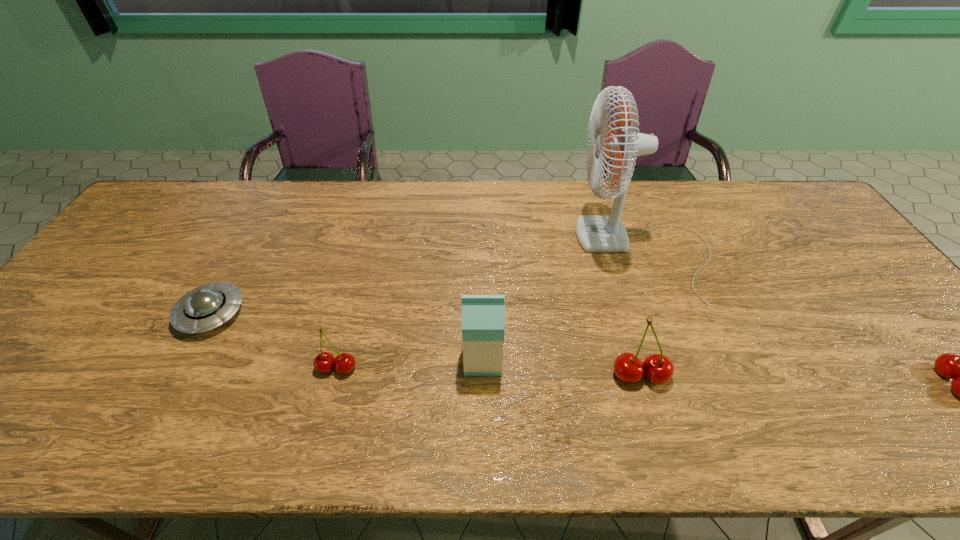
The height and width of the screenshot is (540, 960). I want to click on empty space that is in between the shortest object and the fourth object from right to left, so click(x=347, y=337).

Locate an element on the screen. The height and width of the screenshot is (540, 960). vacant area that lies between the fan and the shortest object is located at coordinates (428, 283).

The height and width of the screenshot is (540, 960). Find the location of `vacant area that lies between the tallest object and the saucer`. vacant area that lies between the tallest object and the saucer is located at coordinates (428, 283).

Where is `empty location between the leftmost object and the second cherry from left to right`? The image size is (960, 540). empty location between the leftmost object and the second cherry from left to right is located at coordinates (425, 345).

I want to click on object that can be found as the second closest to the third object from left to right, so click(x=659, y=369).

Point out which object is positioned as the fourth nearest to the saucer. Please provide its 2D coordinates. Your answer should be formatted as a tuple, i.e. [(x, y)], where the tuple contains the x and y coordinates of a point satisfying the conditions above.

[(659, 369)]

Select which cherry is the closest to the fan. Please provide its 2D coordinates. Your answer should be formatted as a tuple, i.e. [(x, y)], where the tuple contains the x and y coordinates of a point satisfying the conditions above.

[(659, 369)]

Where is `cherry that is the second closest to the second tallest cherry`? This screenshot has height=540, width=960. cherry that is the second closest to the second tallest cherry is located at coordinates (324, 362).

Where is `vacant area in the image that satisfies the following two spatial constraints: 1. on the front-facing side of the tallest object; 2. with the stems of the second shortest object pointing upwards`? vacant area in the image that satisfies the following two spatial constraints: 1. on the front-facing side of the tallest object; 2. with the stems of the second shortest object pointing upwards is located at coordinates click(x=689, y=368).

Locate an element on the screen. The height and width of the screenshot is (540, 960). free space that satisfies the following two spatial constraints: 1. on the front-facing side of the tallest object; 2. with the stems of the leftmost cherry pointing upwards is located at coordinates (689, 368).